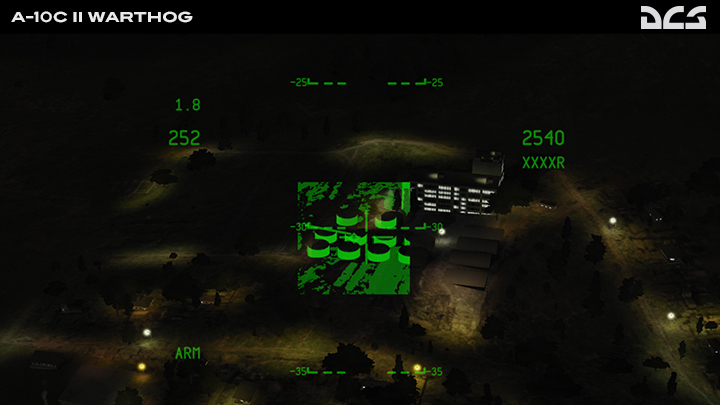
Where is `white lighting`? white lighting is located at coordinates (139, 366), (143, 333), (415, 364), (440, 231), (611, 218), (670, 311).